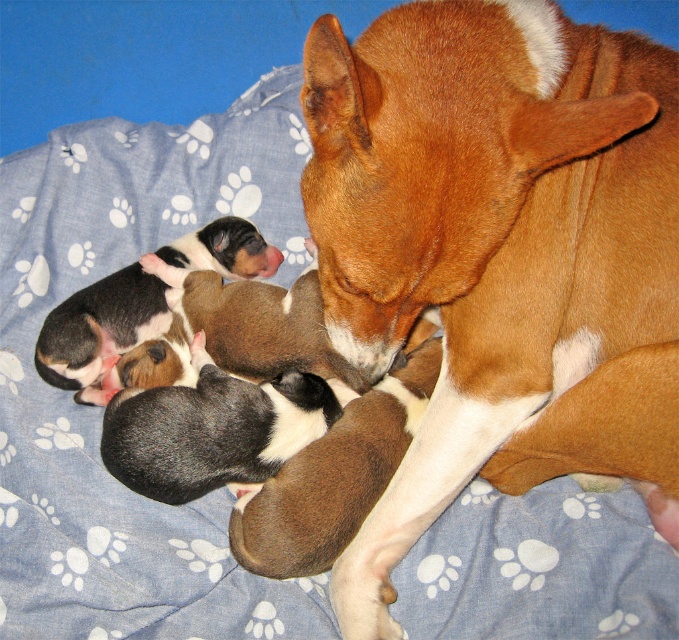
You are a veterinarian observing a mother dog and her puppies. You notice the brown smooth dog at center and the black and white fur at center. Which one is positioned higher in the image?

The brown smooth dog at center is above the black and white fur at center, so the brown smooth dog at center is positioned higher in the image.

You are taking a photo of the mother dog and her puppies. You notice two points in the image at coordinates point (132, 419) and point (120, 340). Which point is closer to your camera?

Point (132, 419) is closer to the camera than point (120, 340).

You are a photographer taking a picture of the brown smooth dog at center and the black and white fur at center. Which one should you focus on first if you want to capture both clearly?

The brown smooth dog at center is closer to the viewer than the black and white fur at center, so you should focus on the brown smooth dog at center first to ensure both are in focus.